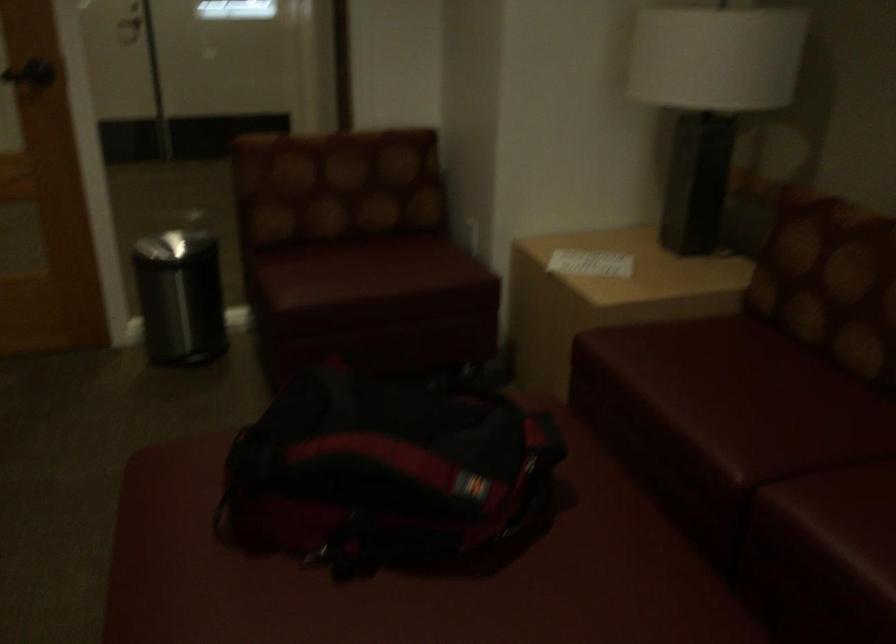
Image resolution: width=896 pixels, height=644 pixels. Identify the location of metal trash can. (179, 297).